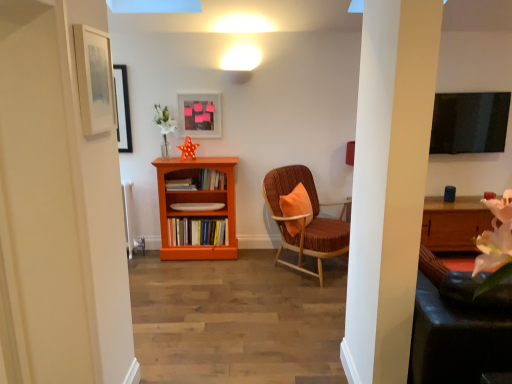
I want to click on free space in front of orange wood bookshelf at center, so click(x=190, y=279).